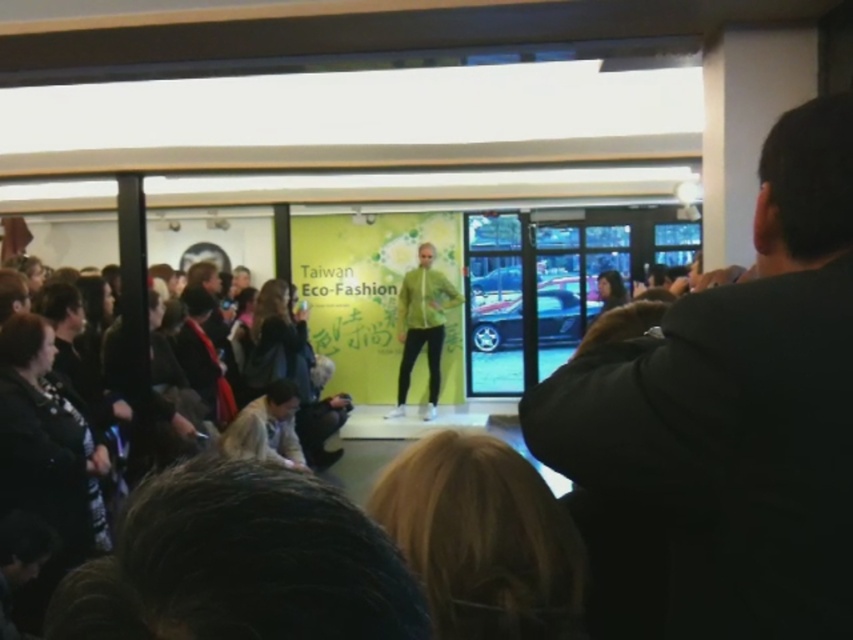
Question: In this image, where is dark brown leather jacket at lower left located relative to green matte jacket at center?

Choices:
 (A) below
 (B) above

Answer: (A)

Question: From the image, what is the correct spatial relationship of black jacket at right in relation to dark brown leather jacket at lower left?

Choices:
 (A) below
 (B) above

Answer: (B)

Question: Which of the following is the farthest from the observer?

Choices:
 (A) (431, 400)
 (B) (99, 432)
 (C) (819, 218)

Answer: (A)

Question: Which point is farther from the camera taking this photo?

Choices:
 (A) (430, 257)
 (B) (720, 324)

Answer: (A)

Question: Can you confirm if dark brown leather jacket at lower left is positioned to the left of green matte jacket at center?

Choices:
 (A) yes
 (B) no

Answer: (A)

Question: Which point is farther to the camera?

Choices:
 (A) green matte jacket at center
 (B) black jacket at right
 (C) dark brown leather jacket at lower left

Answer: (A)